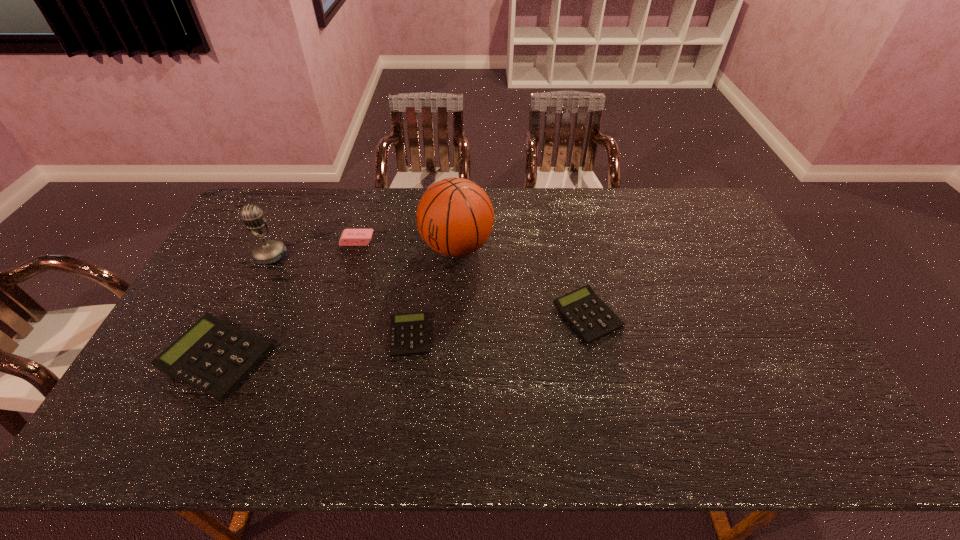
I want to click on free space between the second shortest object and the fourth object from right to left, so click(472, 278).

This screenshot has height=540, width=960. I want to click on free space between the second calculator from right to left and the rightmost object, so click(x=499, y=326).

I want to click on free area in between the basketball and the second shortest object, so click(x=522, y=281).

Where is `vacant area that lies between the leftmost calculator and the shortest object`? This screenshot has height=540, width=960. vacant area that lies between the leftmost calculator and the shortest object is located at coordinates (314, 347).

This screenshot has height=540, width=960. Identify the location of free space between the fifth shortest object and the second calculator from left to right. (340, 296).

The width and height of the screenshot is (960, 540). Find the location of `object that is the third nearest to the second tallest calculator`. object that is the third nearest to the second tallest calculator is located at coordinates (350, 237).

Identify which object is located as the fifth nearest to the third shortest object. Please provide its 2D coordinates. Your answer should be formatted as a tuple, i.e. [(x, y)], where the tuple contains the x and y coordinates of a point satisfying the conditions above.

[(590, 317)]

Identify which calculator is the nearest to the tallest calculator. Please provide its 2D coordinates. Your answer should be formatted as a tuple, i.e. [(x, y)], where the tuple contains the x and y coordinates of a point satisfying the conditions above.

[(409, 335)]

Locate which calculator is the second closest to the fifth shortest object. Please provide its 2D coordinates. Your answer should be formatted as a tuple, i.e. [(x, y)], where the tuple contains the x and y coordinates of a point satisfying the conditions above.

[(409, 335)]

Find the location of a particular element. This screenshot has width=960, height=540. vacant space that satisfies the following two spatial constraints: 1. on the front-facing side of the microphone; 2. on the left side of the second calculator from right to left is located at coordinates [232, 335].